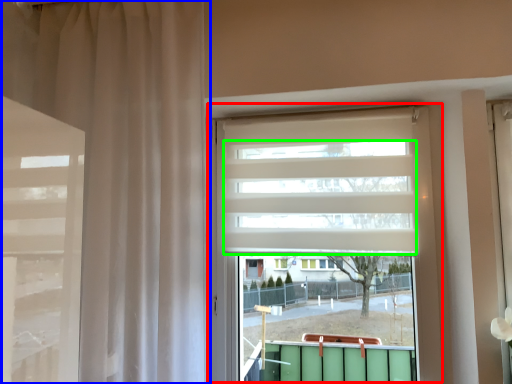
Question: Considering the real-world distances, which object is farthest from window (highlighted by a red box)? curtain (highlighted by a blue box) or blind (highlighted by a green box)?

Choices:
 (A) curtain
 (B) blind

Answer: (A)